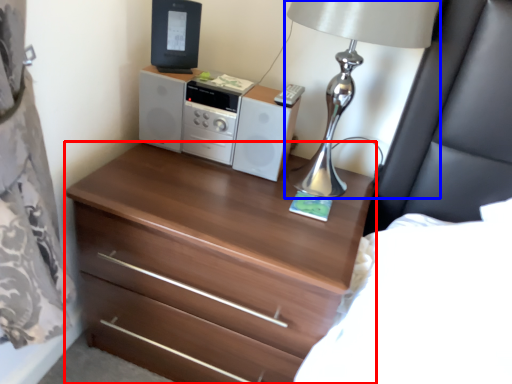
Question: Which point is further to the camera, chest of drawers (highlighted by a red box) or table lamp (highlighted by a blue box)?

Choices:
 (A) chest of drawers
 (B) table lamp

Answer: (A)